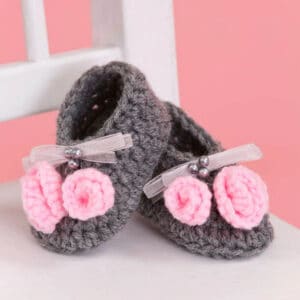
Find the location of `pink wall`. pink wall is located at coordinates (260, 90).